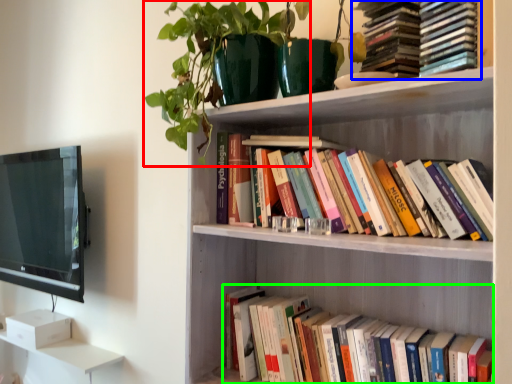
Question: Which object is positioned farthest from plant (highlighted by a red box)? Select from book (highlighted by a blue box) and book (highlighted by a green box).

Choices:
 (A) book
 (B) book

Answer: (B)